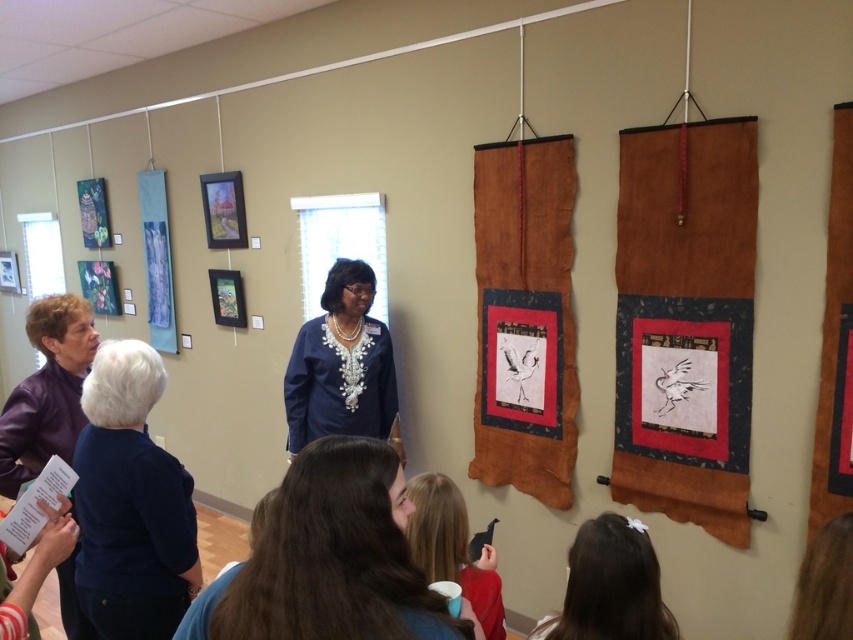
Which is above, rustic brown fabric at center or dark blue sweater at lower left?

Positioned higher is rustic brown fabric at center.

Who is more distant from viewer, (x=495, y=371) or (x=169, y=518)?

Positioned behind is point (x=495, y=371).

The width and height of the screenshot is (853, 640). What are the coordinates of `rustic brown fabric at center` in the screenshot? It's located at (525, 312).

Can you confirm if blue embroidered blouse at center is thinner than matte red shirt at lower center?

Incorrect, blue embroidered blouse at center's width is not less than matte red shirt at lower center's.

Which is in front, point (399, 451) or point (459, 582)?

Point (459, 582) is in front.

Locate an element on the screen. blue embroidered blouse at center is located at coordinates (341, 365).

Is point (105, 480) positioned in front of point (16, 412)?

That is True.

Between point (163, 628) and point (55, 426), which one is positioned in front?

Point (163, 628)

What do you see at coordinates (131, 502) in the screenshot?
I see `dark blue sweater at lower left` at bounding box center [131, 502].

Find the location of a particular element. dark blue sweater at lower left is located at coordinates click(131, 502).